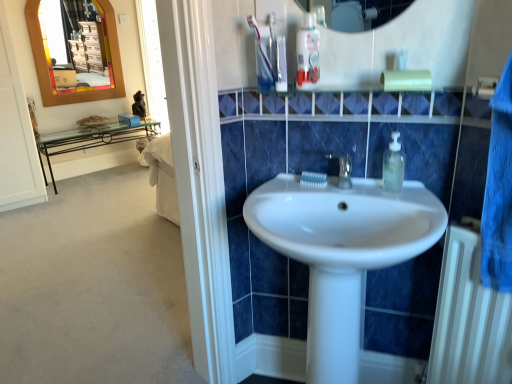
In order to click on clear plastic soap dispenser at upper right in this screenshot , I will do `click(393, 165)`.

Find the location of `clear plastic mouthwash at upper center`. clear plastic mouthwash at upper center is located at coordinates click(308, 51).

Image resolution: width=512 pixels, height=384 pixels. I want to click on white glossy sink at center, so click(x=342, y=252).

I want to click on wooden-framed mirror at upper left, so click(76, 44).

Where is `clear plastic soap dispenser at upper right`? The width and height of the screenshot is (512, 384). clear plastic soap dispenser at upper right is located at coordinates (393, 165).

Between white glossy sink at center and white glossy toothpaste at upper center, the second toothpaste in the back-to-front sequence, which one appears on the right side from the viewer's perspective?

From the viewer's perspective, white glossy sink at center appears more on the right side.

From a real-world perspective, which object stands above the other?

From a 3D spatial view, white glossy toothpaste at upper center, the second toothpaste in the back-to-front sequence, is above.

Which of these two, white glossy sink at center or white glossy toothpaste at upper center, placed as the first toothpaste when sorted from front to back, stands taller?

Standing taller between the two is white glossy sink at center.

Is point (400, 362) positioned in front of point (310, 69)?

No, (400, 362) is behind (310, 69).

Consider the image. In terms of width, does white glossy sink at center look wider or thinner when compared to clear plastic mouthwash at upper center?

In the image, white glossy sink at center appears to be wider than clear plastic mouthwash at upper center.

Is white glossy sink at center in contact with clear plastic mouthwash at upper center?

No, white glossy sink at center is not beside clear plastic mouthwash at upper center.

Considering the sizes of white glossy sink at center and clear plastic mouthwash at upper center in the image, is white glossy sink at center taller or shorter than clear plastic mouthwash at upper center?

Considering their sizes, white glossy sink at center has more height than clear plastic mouthwash at upper center.

From the picture: Is clear plastic mouthwash at upper center looking in the opposite direction of white metallic radiator at lower right?

No, clear plastic mouthwash at upper center is not facing the opposite direction of white metallic radiator at lower right.

From a real-world perspective, between clear plastic mouthwash at upper center and white metallic radiator at lower right, who is vertically higher?

clear plastic mouthwash at upper center.

What's the angular difference between clear plastic mouthwash at upper center and white metallic radiator at lower right's facing directions?

There is a 92.7-degree angle between the facing directions of clear plastic mouthwash at upper center and white metallic radiator at lower right.

Looking at this image, would you say clear plastic mouthwash at upper center is inside or outside white metallic radiator at lower right?

clear plastic mouthwash at upper center is spatially situated outside white metallic radiator at lower right.

The height and width of the screenshot is (384, 512). In order to click on mirror that is behind the clear plastic soap dispenser at upper right in this screenshot , I will do tap(76, 44).

From a real-world perspective, is wooden-framed mirror at upper left positioned above or below clear plastic soap dispenser at upper right?

From a real-world perspective, wooden-framed mirror at upper left is physically above clear plastic soap dispenser at upper right.

Is wooden-framed mirror at upper left to the left of clear plastic soap dispenser at upper right from the viewer's perspective?

Correct, you'll find wooden-framed mirror at upper left to the left of clear plastic soap dispenser at upper right.

From the image's perspective, which one is positioned lower, white glossy toothpaste at upper center, which is the 2th toothpaste from bottom to top, or white glossy toothpaste at center, the second toothpaste viewed from the left?

white glossy toothpaste at center, the second toothpaste viewed from the left.

Is the depth of white glossy toothpaste at upper center, which is the 2th toothpaste from bottom to top, less than that of white glossy toothpaste at center, positioned as the second toothpaste in top-to-bottom order?

That is True.

Is white glossy toothpaste at upper center, the first toothpaste in the top-to-bottom sequence, facing towards white glossy toothpaste at center, the second toothpaste viewed from the left?

No, white glossy toothpaste at upper center, the first toothpaste in the top-to-bottom sequence, is not aimed at white glossy toothpaste at center, the second toothpaste viewed from the left.

From a real-world perspective, is white glossy toothpaste at upper center, which is the 2th toothpaste from bottom to top, on top of white glossy toothpaste at center, which is the second toothpaste from front to back?

Correct, in the physical world, white glossy toothpaste at upper center, which is the 2th toothpaste from bottom to top, is higher than white glossy toothpaste at center, which is the second toothpaste from front to back.

Where is `the 1st toothpaste to the right of the wooden-framed mirror at upper left, counting from the anchor's position`? the 1st toothpaste to the right of the wooden-framed mirror at upper left, counting from the anchor's position is located at coordinates (264, 55).

Considering the sizes of objects white glossy toothpaste at upper center, the second toothpaste in the back-to-front sequence, and wooden-framed mirror at upper left in the image provided, who is wider, white glossy toothpaste at upper center, the second toothpaste in the back-to-front sequence, or wooden-framed mirror at upper left?

With larger width is white glossy toothpaste at upper center, the second toothpaste in the back-to-front sequence.

From the picture: Would you say white glossy toothpaste at upper center, the first toothpaste in the top-to-bottom sequence, is inside or outside wooden-framed mirror at upper left?

white glossy toothpaste at upper center, the first toothpaste in the top-to-bottom sequence, exists outside the volume of wooden-framed mirror at upper left.

From the image's perspective, which is below, white glossy toothpaste at upper center, which is the first toothpaste in left-to-right order, or wooden-framed mirror at upper left?

white glossy toothpaste at upper center, which is the first toothpaste in left-to-right order, from the image's perspective.

Does point (473, 294) come closer to viewer compared to point (326, 175)?

Yes.

From the image's perspective, between white metallic radiator at lower right and white glossy toothpaste at center, the first toothpaste positioned from the right, who is located below?

From the image's view, white metallic radiator at lower right is below.

Does white metallic radiator at lower right appear on the right side of white glossy toothpaste at center, the first toothpaste positioned from the right?

Indeed, white metallic radiator at lower right is positioned on the right side of white glossy toothpaste at center, the first toothpaste positioned from the right.

Considering the sizes of objects white metallic radiator at lower right and white glossy toothpaste at center, the first toothpaste positioned from the right, in the image provided, who is shorter, white metallic radiator at lower right or white glossy toothpaste at center, the first toothpaste positioned from the right,?

With less height is white glossy toothpaste at center, the first toothpaste positioned from the right.

From the white glossy sink at center, count the 2nd toothpaste to the left and point to it. Please provide its 2D coordinates.

[(264, 55)]

Identify the location of mouthwash above the white glossy sink at center (from the image's perspective). (308, 51).

When comparing their distances from white glossy sink at center, does white metallic radiator at lower right or wooden-framed mirror at upper left seem closer?

white metallic radiator at lower right is positioned closer to the anchor white glossy sink at center.

Estimate the real-world distances between objects in this image. Which object is further from white glossy toothpaste at center, positioned as the second toothpaste in top-to-bottom order, wooden-framed mirror at upper left or white glossy toothpaste at upper center, the first toothpaste in the top-to-bottom sequence?

wooden-framed mirror at upper left.

Which object lies further to the anchor point clear plastic soap dispenser at upper right, clear plastic mouthwash at upper center or white glossy toothpaste at center, positioned as the second toothpaste in top-to-bottom order?

clear plastic mouthwash at upper center is positioned further to the anchor clear plastic soap dispenser at upper right.

Estimate the real-world distances between objects in this image. Which object is closer to white glossy toothpaste at upper center, the first toothpaste in the top-to-bottom sequence, white glossy sink at center or clear plastic soap dispenser at upper right?

Among the two, clear plastic soap dispenser at upper right is located nearer to white glossy toothpaste at upper center, the first toothpaste in the top-to-bottom sequence.

Considering their positions, is white glossy toothpaste at upper center, which is the second toothpaste in right-to-left order, positioned further to white glossy toothpaste at center, the second toothpaste viewed from the left, than white glossy sink at center?

Based on the image, white glossy toothpaste at upper center, which is the second toothpaste in right-to-left order, appears to be further to white glossy toothpaste at center, the second toothpaste viewed from the left.

Which object lies further to the anchor point wooden-framed mirror at upper left, clear plastic mouthwash at upper center or white glossy sink at center?

white glossy sink at center.

Based on the photo, estimate the real-world distances between objects in this image. Which object is further from clear plastic soap dispenser at upper right, wooden-framed mirror at upper left or white glossy toothpaste at upper center, placed as the first toothpaste when sorted from front to back?

wooden-framed mirror at upper left is positioned further to the anchor clear plastic soap dispenser at upper right.

Considering their positions, is wooden-framed mirror at upper left positioned closer to white metallic radiator at lower right than clear plastic mouthwash at upper center?

clear plastic mouthwash at upper center.

This screenshot has height=384, width=512. In order to click on soap dispenser between white glossy toothpaste at upper center, the second toothpaste in the back-to-front sequence, and white glossy sink at center vertically in this screenshot , I will do `click(393, 165)`.

Locate an element on the screen. toothpaste between clear plastic soap dispenser at upper right and wooden-framed mirror at upper left from front to back is located at coordinates (313, 179).

The height and width of the screenshot is (384, 512). Find the location of `toothpaste between clear plastic mouthwash at upper center and white metallic radiator at lower right in the up-down direction`. toothpaste between clear plastic mouthwash at upper center and white metallic radiator at lower right in the up-down direction is located at coordinates (313, 179).

I want to click on sink that lies between white glossy toothpaste at center, acting as the first toothpaste starting from the back, and white metallic radiator at lower right from top to bottom, so click(342, 252).